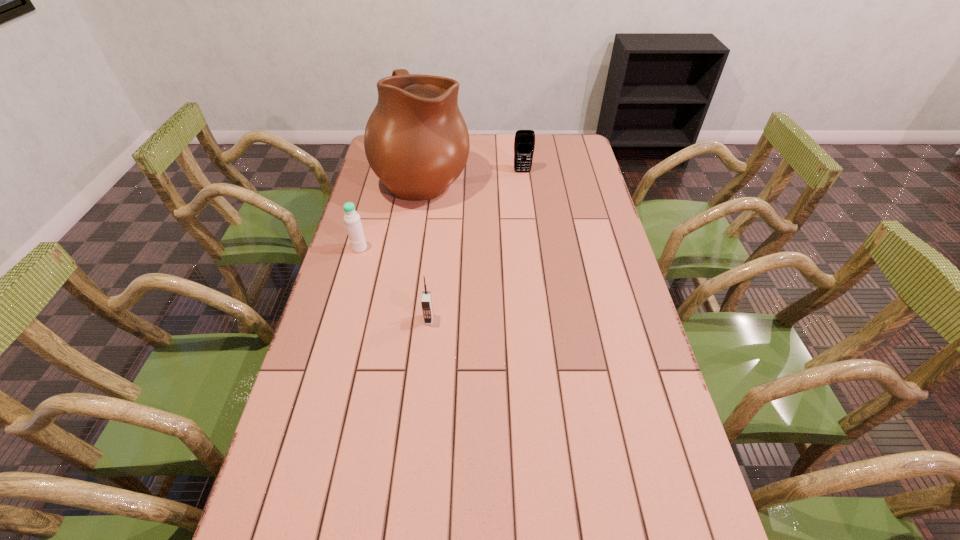
The height and width of the screenshot is (540, 960). Identify the location of object located at the far edge. (416, 141).

Identify the location of cream pitcher that is at the left edge. This screenshot has height=540, width=960. (416, 141).

This screenshot has height=540, width=960. Identify the location of water bottle at the left edge. (353, 224).

In order to click on object at the far left corner in this screenshot , I will do pyautogui.click(x=416, y=141).

You are a GUI agent. You are given a task and a screenshot of the screen. Output one action in this format:
    pyautogui.click(x=<x>, y=<y>)
    Task: Click on the blank space at the left edge of the desktop
    Image resolution: width=960 pixels, height=540 pixels.
    Given the screenshot: What is the action you would take?
    pyautogui.click(x=357, y=350)

Find the location of a particular element. This screenshot has width=960, height=540. vacant space at the right edge of the desktop is located at coordinates (571, 176).

Image resolution: width=960 pixels, height=540 pixels. In the image, there is a desktop. Find the location of `vacant space at the far right corner`. vacant space at the far right corner is located at coordinates (545, 136).

Find the location of a particular element. This screenshot has height=540, width=960. vacant area that lies between the water bottle and the nearest object is located at coordinates (395, 284).

At what (x,y) coordinates should I click in order to perform the action: click on empty space between the third farthest object and the cream pitcher. Please return your answer as a coordinate pair (x, y). The width and height of the screenshot is (960, 540). Looking at the image, I should click on point(392,213).

The image size is (960, 540). I want to click on empty location between the rightmost object and the cream pitcher, so click(473, 174).